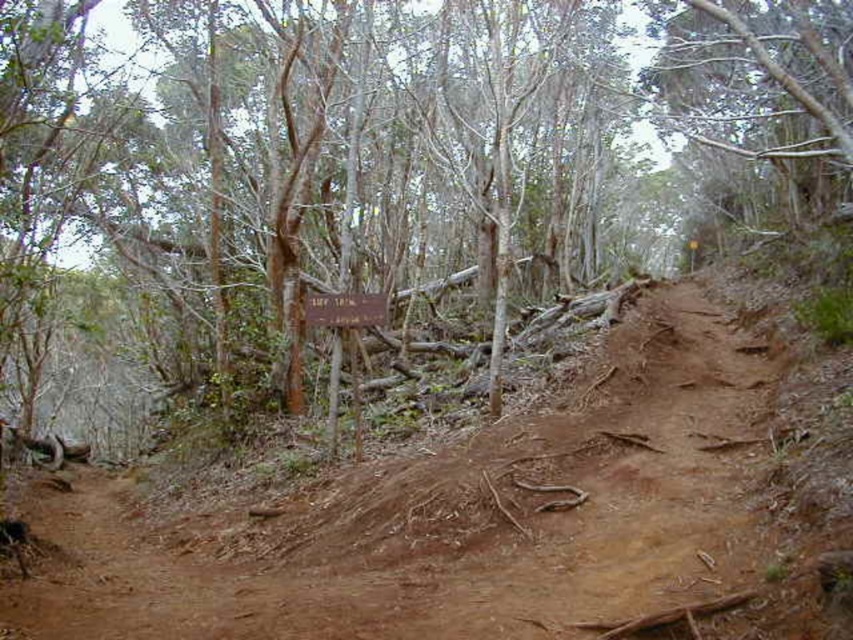
Measure the distance between brown bark tree at center and camera.

4.87 meters

Does brown bark tree at center have a lesser height compared to brown dirt track at center?

In fact, brown bark tree at center may be taller than brown dirt track at center.

Where is `brown bark tree at center`? The image size is (853, 640). brown bark tree at center is located at coordinates (422, 150).

Is brown bark tree at center bigger than wooden sign at center?

Yes.

Who is taller, brown bark tree at center or wooden sign at center?

With more height is brown bark tree at center.

The width and height of the screenshot is (853, 640). I want to click on brown bark tree at center, so click(x=422, y=150).

The width and height of the screenshot is (853, 640). I want to click on brown bark tree at center, so click(422, 150).

Can you confirm if brown dirt track at center is shorter than wooden sign at center?

Incorrect, brown dirt track at center's height does not fall short of wooden sign at center's.

What do you see at coordinates (456, 518) in the screenshot? This screenshot has width=853, height=640. I see `brown dirt track at center` at bounding box center [456, 518].

This screenshot has width=853, height=640. What are the coordinates of `brown dirt track at center` in the screenshot? It's located at (456, 518).